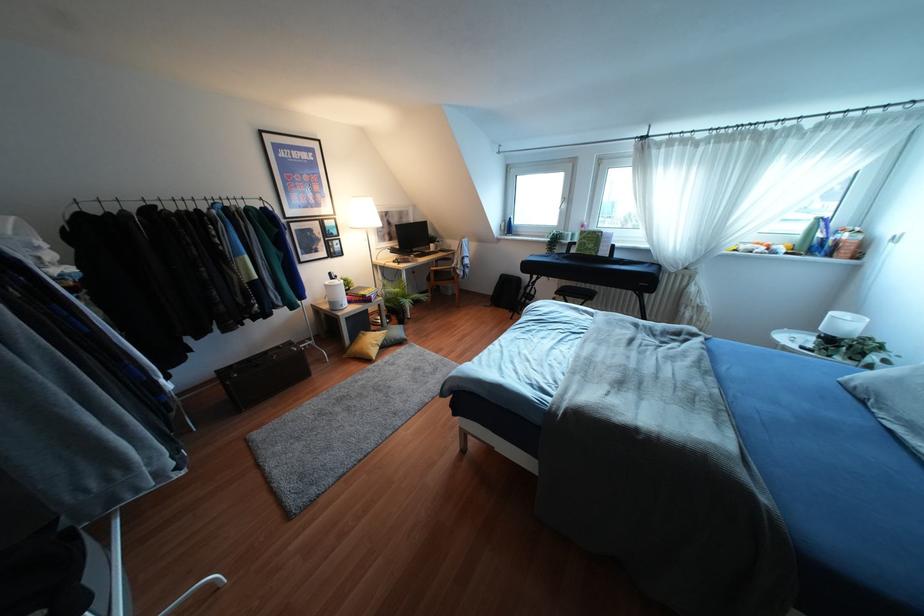
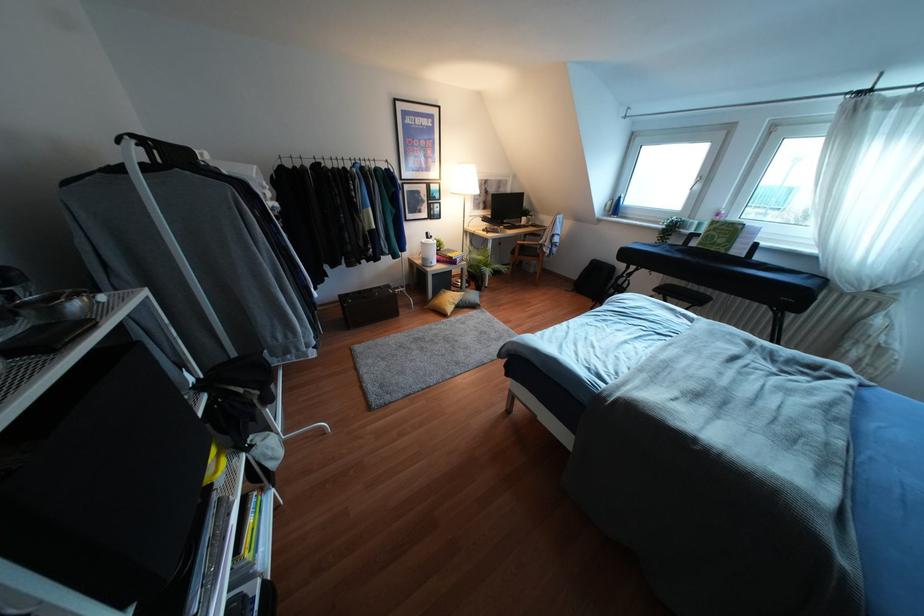
The point at (x=584, y=243) is marked in the first image. Where is the corresponding point in the second image?

(712, 236)